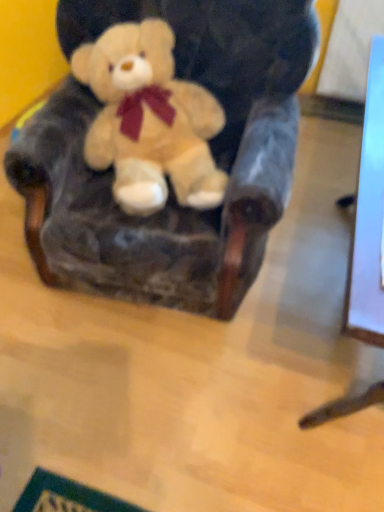
Question: Considering the relative sizes of soft plush teddy bear at center and velvet plush bear at center in the image provided, is soft plush teddy bear at center shorter than velvet plush bear at center?

Choices:
 (A) yes
 (B) no

Answer: (A)

Question: Does soft plush teddy bear at center have a larger size compared to velvet plush bear at center?

Choices:
 (A) no
 (B) yes

Answer: (A)

Question: Is soft plush teddy bear at center beside velvet plush bear at center?

Choices:
 (A) yes
 (B) no

Answer: (B)

Question: Can you confirm if soft plush teddy bear at center is wider than velvet plush bear at center?

Choices:
 (A) yes
 (B) no

Answer: (B)

Question: From a real-world perspective, is soft plush teddy bear at center physically below velvet plush bear at center?

Choices:
 (A) no
 (B) yes

Answer: (A)

Question: Is soft plush teddy bear at center surrounding velvet plush bear at center?

Choices:
 (A) yes
 (B) no

Answer: (B)

Question: Considering the relative sizes of velvet plush bear at center and soft plush teddy bear at center in the image provided, is velvet plush bear at center thinner than soft plush teddy bear at center?

Choices:
 (A) yes
 (B) no

Answer: (B)

Question: Does velvet plush bear at center come in front of soft plush teddy bear at center?

Choices:
 (A) no
 (B) yes

Answer: (B)

Question: Does velvet plush bear at center touch soft plush teddy bear at center?

Choices:
 (A) no
 (B) yes

Answer: (A)

Question: Is velvet plush bear at center not near soft plush teddy bear at center?

Choices:
 (A) yes
 (B) no

Answer: (B)

Question: Is velvet plush bear at center shorter than soft plush teddy bear at center?

Choices:
 (A) no
 (B) yes

Answer: (A)

Question: From the image's perspective, is velvet plush bear at center located above soft plush teddy bear at center?

Choices:
 (A) no
 (B) yes

Answer: (A)

Question: Is velvet plush bear at center taller or shorter than soft plush teddy bear at center?

Choices:
 (A) tall
 (B) short

Answer: (A)